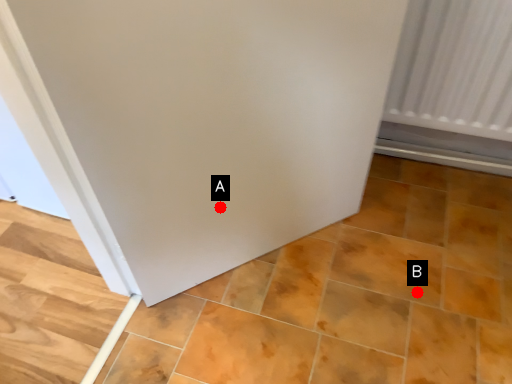
Question: Two points are circled on the image, labeled by A and B beside each circle. Which point is closer to the camera taking this photo?

Choices:
 (A) A is closer
 (B) B is closer

Answer: (A)